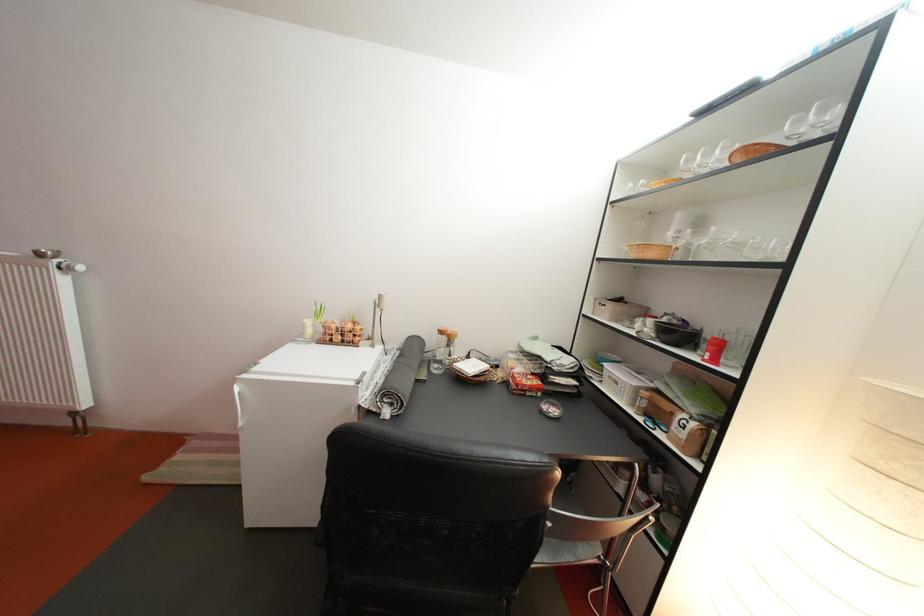
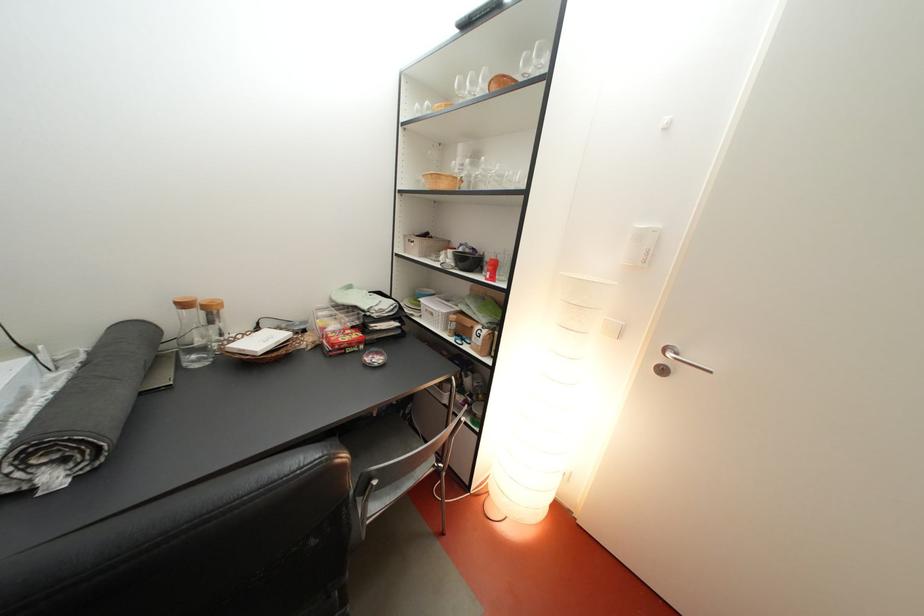
Question: Based on the continuous images, in which direction is the camera rotating? Reply with the corresponding letter.

Choices:
 (A) Left
 (B) Right
 (C) Up
 (D) Down

Answer: (B)